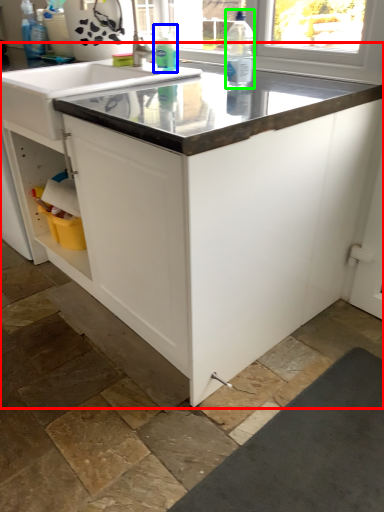
Question: Which is farther away from countertop (highlighted by a red box)? cleaning product (highlighted by a blue box) or bottle (highlighted by a green box)?

Choices:
 (A) cleaning product
 (B) bottle

Answer: (A)